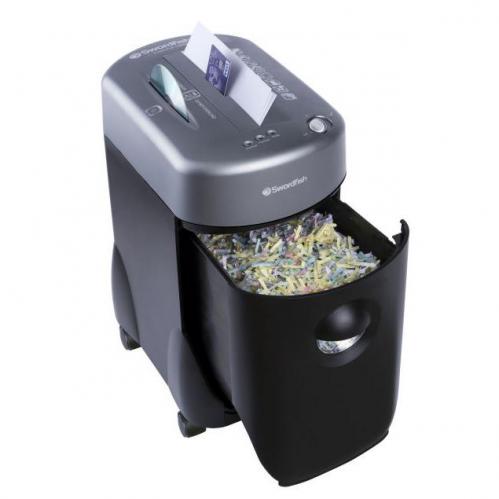
Find the location of a particular element. Image resolution: width=499 pixels, height=499 pixels. handle is located at coordinates (348, 318).